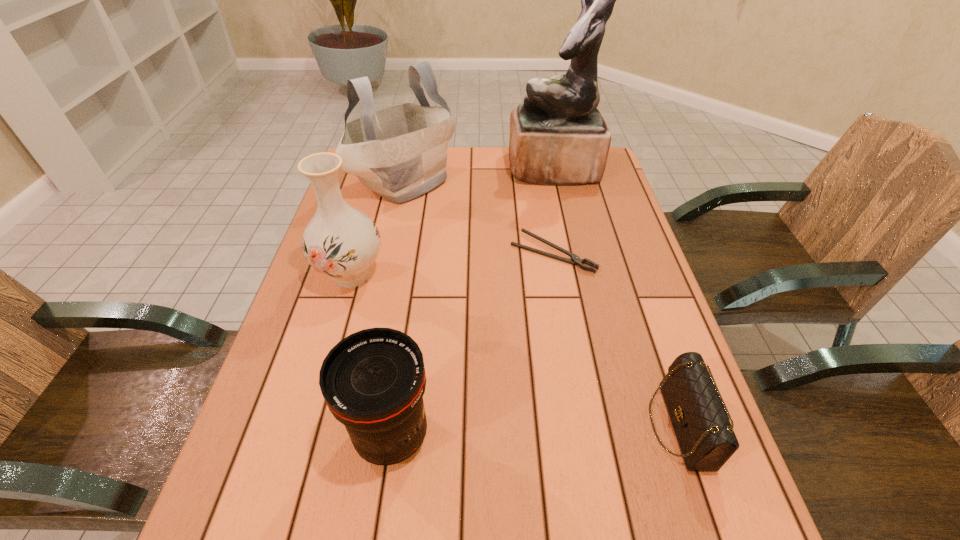
Image resolution: width=960 pixels, height=540 pixels. Identify the location of vacant space located on the right of the vase. (426, 274).

Where is `vacant space located on the right of the fourth tallest object`? This screenshot has width=960, height=540. vacant space located on the right of the fourth tallest object is located at coordinates (583, 435).

Where is `free space located on the front flap of the clutch bag`? This screenshot has height=540, width=960. free space located on the front flap of the clutch bag is located at coordinates (522, 425).

You are a GUI agent. You are given a task and a screenshot of the screen. Output one action in this format:
    pyautogui.click(x=<x>, y=<y>)
    Task: Click on the free space located 0.080m on the front flap of the clutch bag
    The image size is (960, 540).
    Given the screenshot: What is the action you would take?
    pyautogui.click(x=609, y=425)

The image size is (960, 540). I want to click on vacant area situated on the front flap of the clutch bag, so 479,425.

Find the location of a particular element. This screenshot has width=960, height=540. vacant space positioned on the front of the shortest object is located at coordinates (560, 293).

Find the location of a particular element. The image size is (960, 540). sculpture positioned at the far edge is located at coordinates (558, 136).

Where is `shopping bag at the far edge`? The width and height of the screenshot is (960, 540). shopping bag at the far edge is located at coordinates [400, 153].

The width and height of the screenshot is (960, 540). In order to click on shopping bag positioned at the left edge in this screenshot , I will do `click(400, 153)`.

Locate an element on the screen. vase situated at the left edge is located at coordinates (341, 242).